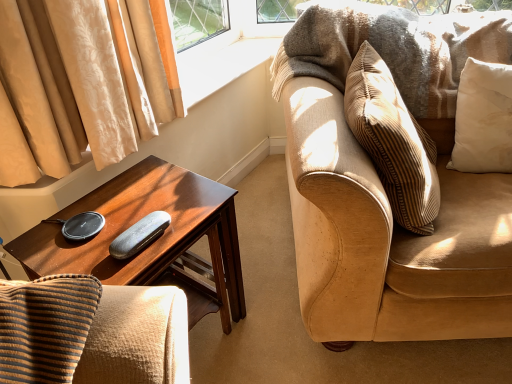
Question: Is shiny brown wood desk at left to the right of black textured case at center from the viewer's perspective?

Choices:
 (A) no
 (B) yes

Answer: (A)

Question: Is shiny brown wood desk at left oriented away from black textured case at center?

Choices:
 (A) no
 (B) yes

Answer: (A)

Question: From a real-world perspective, does shiny brown wood desk at left sit lower than black textured case at center?

Choices:
 (A) yes
 (B) no

Answer: (A)

Question: Considering the relative sizes of shiny brown wood desk at left and black textured case at center in the image provided, is shiny brown wood desk at left bigger than black textured case at center?

Choices:
 (A) yes
 (B) no

Answer: (A)

Question: Is shiny brown wood desk at left closer to camera compared to black textured case at center?

Choices:
 (A) yes
 (B) no

Answer: (A)

Question: Is shiny brown wood desk at left smaller than black textured case at center?

Choices:
 (A) yes
 (B) no

Answer: (B)

Question: Is black textured case at center touching white cotton pillow at upper right?

Choices:
 (A) no
 (B) yes

Answer: (A)

Question: Is black textured case at center taller than white cotton pillow at upper right?

Choices:
 (A) yes
 (B) no

Answer: (B)

Question: Could you tell me if black textured case at center is turned towards white cotton pillow at upper right?

Choices:
 (A) no
 (B) yes

Answer: (A)

Question: Considering the relative sizes of black textured case at center and white cotton pillow at upper right in the image provided, is black textured case at center thinner than white cotton pillow at upper right?

Choices:
 (A) yes
 (B) no

Answer: (A)

Question: Considering the relative sizes of black textured case at center and white cotton pillow at upper right in the image provided, is black textured case at center bigger than white cotton pillow at upper right?

Choices:
 (A) no
 (B) yes

Answer: (A)

Question: From the image's perspective, is black textured case at center above white cotton pillow at upper right?

Choices:
 (A) yes
 (B) no

Answer: (B)

Question: Is suede couch at right oriented away from shiny brown wood desk at left?

Choices:
 (A) no
 (B) yes

Answer: (A)